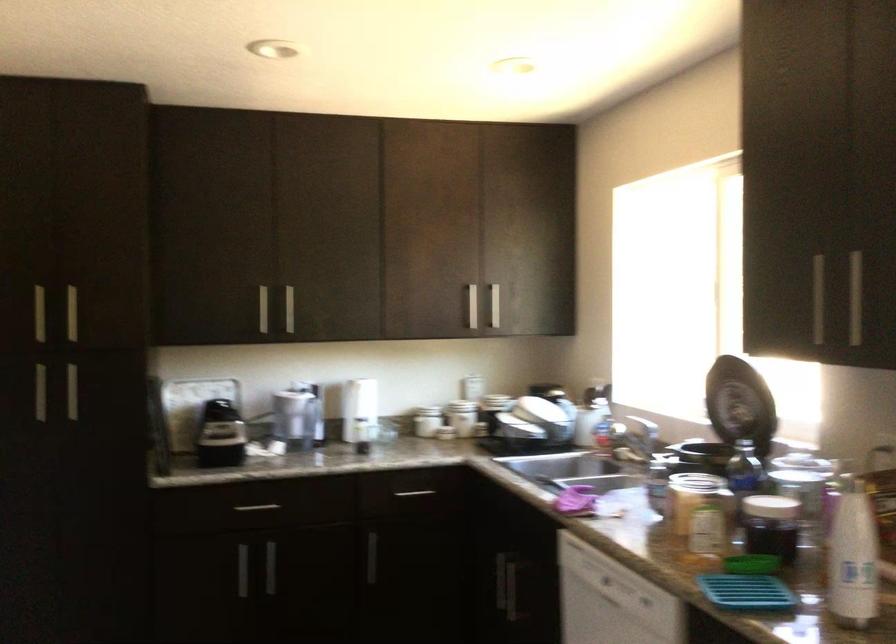
Question: Based on the continuous images, in which direction is the camera rotating? Reply with the corresponding letter.

Choices:
 (A) Left
 (B) Right
 (C) Up
 (D) Down

Answer: (B)